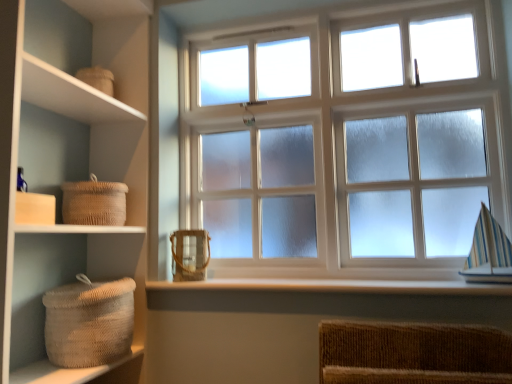
Question: Can you confirm if white smooth wood at lower center is bigger than brown woven basket at center, which is counted as the second basket, starting from the bottom?

Choices:
 (A) no
 (B) yes

Answer: (B)

Question: Are white smooth wood at lower center and brown woven basket at center, which is counted as the second basket, starting from the bottom, beside each other?

Choices:
 (A) yes
 (B) no

Answer: (B)

Question: From a real-world perspective, is white smooth wood at lower center below brown woven basket at center, which is counted as the second basket, starting from the bottom?

Choices:
 (A) yes
 (B) no

Answer: (A)

Question: Can you confirm if white smooth wood at lower center is smaller than brown woven basket at center, which is the second basket from top to bottom?

Choices:
 (A) no
 (B) yes

Answer: (A)

Question: Is white smooth wood at lower center not within brown woven basket at center, which is the second basket from top to bottom?

Choices:
 (A) no
 (B) yes

Answer: (B)

Question: Is white smooth wood at lower center to the right of brown woven basket at center, which is the second basket from top to bottom, from the viewer's perspective?

Choices:
 (A) no
 (B) yes

Answer: (B)

Question: Is frosted glass window at center not close to woven natural fiber basket at left, which is the 1th basket from top to bottom?

Choices:
 (A) no
 (B) yes

Answer: (A)

Question: Is frosted glass window at center to the left of woven natural fiber basket at left, acting as the 3th basket starting from the bottom, from the viewer's perspective?

Choices:
 (A) yes
 (B) no

Answer: (B)

Question: Is frosted glass window at center turned away from woven natural fiber basket at left, which is the 1th basket from top to bottom?

Choices:
 (A) yes
 (B) no

Answer: (B)

Question: From the image's perspective, would you say frosted glass window at center is positioned over woven natural fiber basket at left, acting as the 3th basket starting from the bottom?

Choices:
 (A) no
 (B) yes

Answer: (B)

Question: Considering the relative sizes of frosted glass window at center and woven natural fiber basket at left, acting as the 3th basket starting from the bottom, in the image provided, is frosted glass window at center taller than woven natural fiber basket at left, acting as the 3th basket starting from the bottom,?

Choices:
 (A) yes
 (B) no

Answer: (A)

Question: From the image's perspective, is frosted glass window at center under woven natural fiber basket at left, acting as the 3th basket starting from the bottom?

Choices:
 (A) no
 (B) yes

Answer: (A)

Question: Is woven beige basket at lower left, the first basket in the bottom-to-top sequence, behind frosted glass window at center?

Choices:
 (A) no
 (B) yes

Answer: (A)